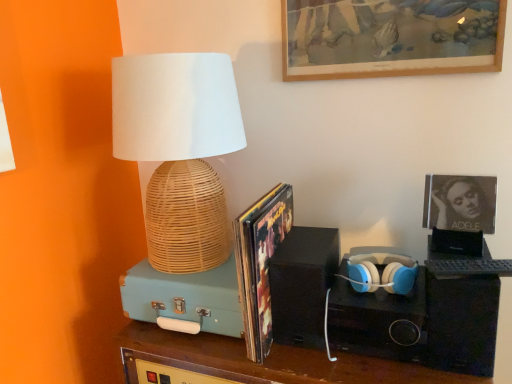
Find the location of a particular element. This screenshot has height=384, width=512. free point in front of black matte speaker at center, marked as the second speaker in a right-to-left arrangement is located at coordinates (327, 361).